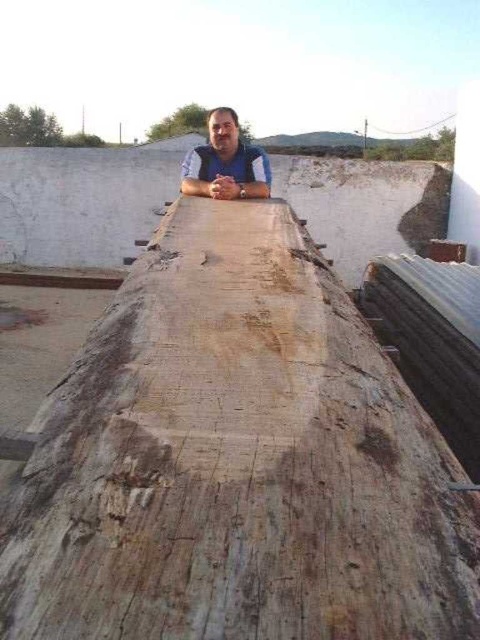
Question: Among these objects, which one is nearest to the camera?

Choices:
 (A) blue matte shirt at center
 (B) weathered wood at center

Answer: (B)

Question: Is the position of weathered wood at center less distant than that of blue matte shirt at center?

Choices:
 (A) no
 (B) yes

Answer: (B)

Question: Which of the following is the farthest from the observer?

Choices:
 (A) (241, 156)
 (B) (254, 364)

Answer: (A)

Question: In this image, where is weathered wood at center located relative to blue matte shirt at center?

Choices:
 (A) right
 (B) left

Answer: (A)

Question: Does weathered wood at center have a lesser width compared to blue matte shirt at center?

Choices:
 (A) yes
 (B) no

Answer: (B)